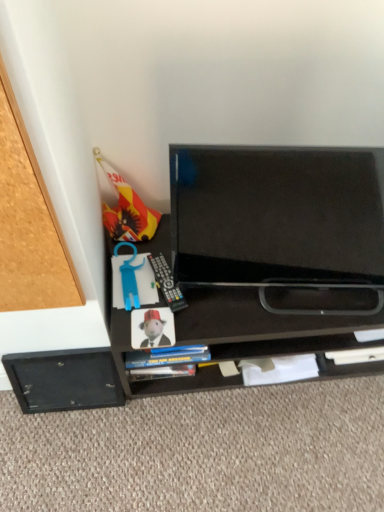
Question: Does matte paper book at center have a lesser height compared to black glossy tv at center?

Choices:
 (A) yes
 (B) no

Answer: (A)

Question: Is black glossy tv at center completely or partially inside matte paper book at center?

Choices:
 (A) no
 (B) yes

Answer: (A)

Question: From the image's perspective, is matte paper book at center over black glossy tv at center?

Choices:
 (A) no
 (B) yes

Answer: (A)

Question: Considering the relative sizes of matte paper book at center and black glossy tv at center in the image provided, is matte paper book at center thinner than black glossy tv at center?

Choices:
 (A) yes
 (B) no

Answer: (A)

Question: Is matte paper book at center facing away from black glossy tv at center?

Choices:
 (A) no
 (B) yes

Answer: (A)

Question: Is matte paper book at center wider or thinner than black matte drawer at lower left?

Choices:
 (A) wide
 (B) thin

Answer: (A)

Question: Considering the positions of matte paper book at center and black matte drawer at lower left in the image, is matte paper book at center taller or shorter than black matte drawer at lower left?

Choices:
 (A) tall
 (B) short

Answer: (B)

Question: In terms of size, does matte paper book at center appear bigger or smaller than black matte drawer at lower left?

Choices:
 (A) big
 (B) small

Answer: (B)

Question: Based on their positions, is matte paper book at center located to the left or right of black matte drawer at lower left?

Choices:
 (A) right
 (B) left

Answer: (A)

Question: From a real-world perspective, is matte paper book at center physically located above or below black matte tv at center?

Choices:
 (A) above
 (B) below

Answer: (A)

Question: Is matte paper book at center wider or thinner than black matte tv at center?

Choices:
 (A) thin
 (B) wide

Answer: (A)

Question: Is matte paper book at center situated inside black matte tv at center or outside?

Choices:
 (A) inside
 (B) outside

Answer: (A)

Question: Is matte paper book at center bigger or smaller than black matte tv at center?

Choices:
 (A) small
 (B) big

Answer: (A)

Question: Is point (162, 330) closer or farther from the camera than point (160, 283)?

Choices:
 (A) closer
 (B) farther

Answer: (A)

Question: From the image's perspective, is matte paper book at center positioned above or below black plastic remote at lower center?

Choices:
 (A) below
 (B) above

Answer: (A)